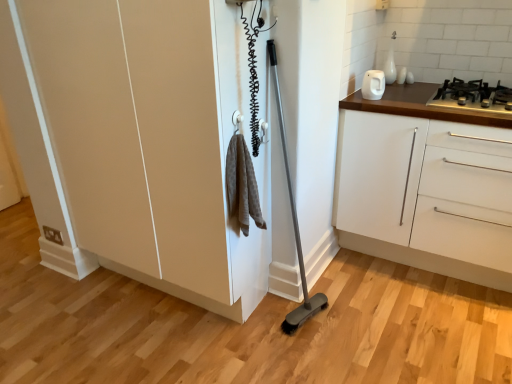
Question: From the image's perspective, is white glossy cabinet at right on top of black metal gas stove at upper right?

Choices:
 (A) no
 (B) yes

Answer: (A)

Question: Considering the relative sizes of white glossy cabinet at right and black metal gas stove at upper right in the image provided, is white glossy cabinet at right shorter than black metal gas stove at upper right?

Choices:
 (A) no
 (B) yes

Answer: (A)

Question: Is white glossy cabinet at right outside black metal gas stove at upper right?

Choices:
 (A) yes
 (B) no

Answer: (A)

Question: Could you tell me if white glossy cabinet at right is turned towards black metal gas stove at upper right?

Choices:
 (A) no
 (B) yes

Answer: (A)

Question: Considering the relative sizes of white glossy cabinet at right and black metal gas stove at upper right in the image provided, is white glossy cabinet at right smaller than black metal gas stove at upper right?

Choices:
 (A) yes
 (B) no

Answer: (B)

Question: Is black metal gas stove at upper right a part of white glossy cabinet at right?

Choices:
 (A) yes
 (B) no

Answer: (B)

Question: Considering the relative sizes of matte beige cupboard at center and black metal gas stove at upper right in the image provided, is matte beige cupboard at center smaller than black metal gas stove at upper right?

Choices:
 (A) no
 (B) yes

Answer: (A)

Question: Is black metal gas stove at upper right a part of matte beige cupboard at center?

Choices:
 (A) yes
 (B) no

Answer: (B)

Question: Is matte beige cupboard at center not near black metal gas stove at upper right?

Choices:
 (A) no
 (B) yes

Answer: (B)

Question: Would you say matte beige cupboard at center is outside black metal gas stove at upper right?

Choices:
 (A) no
 (B) yes

Answer: (B)

Question: From the image's perspective, is matte beige cupboard at center beneath black metal gas stove at upper right?

Choices:
 (A) no
 (B) yes

Answer: (B)

Question: Considering the relative sizes of matte beige cupboard at center and black metal gas stove at upper right in the image provided, is matte beige cupboard at center thinner than black metal gas stove at upper right?

Choices:
 (A) no
 (B) yes

Answer: (B)

Question: Is white glossy kettle at upper right shorter than white glossy cabinet at right?

Choices:
 (A) no
 (B) yes

Answer: (B)